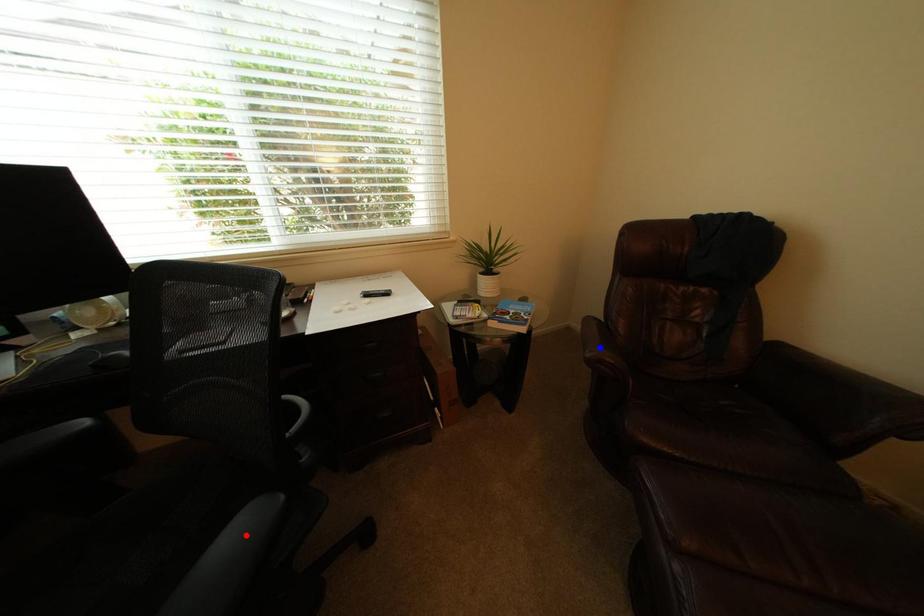
Question: In the image, two points are highlighted. Which point is nearer to the camera? Reply with the corresponding letter.

Choices:
 (A) blue point
 (B) red point

Answer: (B)